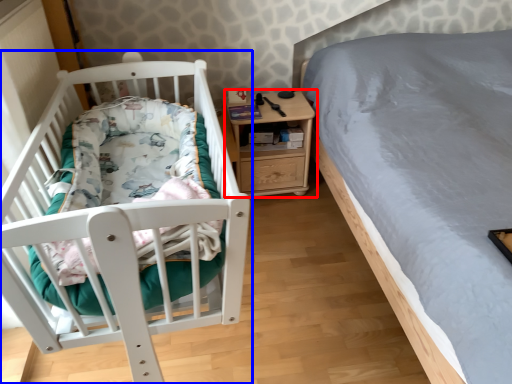
Question: Which point is closer to the camera, nightstand (highlighted by a red box) or infant bed (highlighted by a blue box)?

Choices:
 (A) nightstand
 (B) infant bed

Answer: (B)